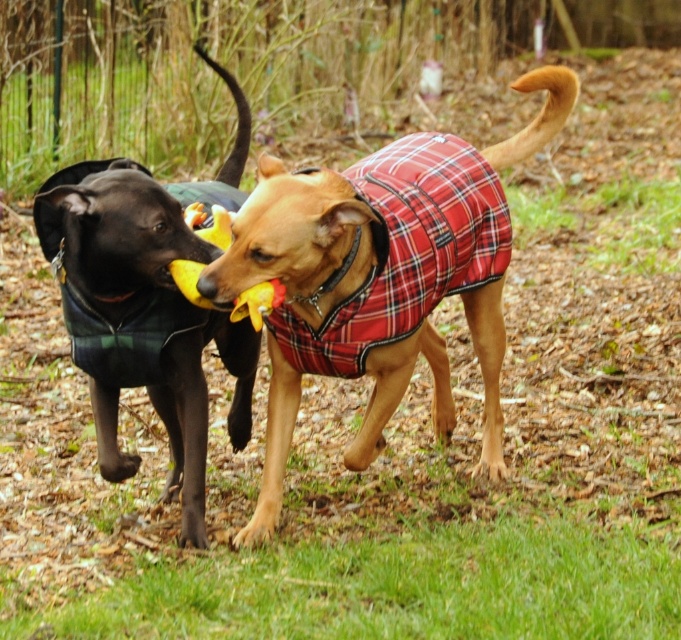
Can you confirm if shiny black coat at left is positioned below yellow rubber duck at center?

Correct, shiny black coat at left is located below yellow rubber duck at center.

Is shiny black coat at left thinner than yellow rubber duck at center?

In fact, shiny black coat at left might be wider than yellow rubber duck at center.

Describe the element at coordinates (146, 307) in the screenshot. I see `shiny black coat at left` at that location.

Locate an element on the screen. shiny black coat at left is located at coordinates (146, 307).

Between point (159, 198) and point (272, 349), which one is positioned behind?

Positioned behind is point (272, 349).

Measure the distance between point (126, 225) and camera.

A distance of 4.17 meters exists between point (126, 225) and camera.

Does point (232, 324) come in front of point (490, 378)?

That is True.

You are a GUI agent. You are given a task and a screenshot of the screen. Output one action in this format:
    pyautogui.click(x=<x>, y=<y>)
    Task: Click on the shiny black coat at left
    The width and height of the screenshot is (681, 640).
    Given the screenshot: What is the action you would take?
    pyautogui.click(x=146, y=307)

Who is more forward, (498,321) or (176,259)?

Positioned in front is point (176,259).

Is plaid fabric dog coat at center below yellow rubber duck at center?

Correct, plaid fabric dog coat at center is located below yellow rubber duck at center.

Identify the location of plaid fabric dog coat at center. The image size is (681, 640). (298, 289).